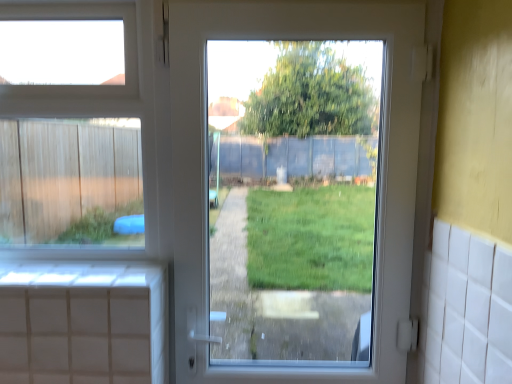
Question: Could you tell me if white glossy door at center is turned towards transparent glass window at upper left?

Choices:
 (A) yes
 (B) no

Answer: (B)

Question: Are white glossy door at center and transparent glass window at upper left located far from each other?

Choices:
 (A) yes
 (B) no

Answer: (B)

Question: Is white glossy door at center taller than transparent glass window at upper left?

Choices:
 (A) yes
 (B) no

Answer: (A)

Question: Is white glossy door at center looking in the opposite direction of transparent glass window at upper left?

Choices:
 (A) yes
 (B) no

Answer: (B)

Question: From a real-world perspective, is white glossy door at center located higher than transparent glass window at upper left?

Choices:
 (A) yes
 (B) no

Answer: (B)

Question: Is white glossy door at center to the left of transparent glass window at upper left from the viewer's perspective?

Choices:
 (A) yes
 (B) no

Answer: (B)

Question: Is there a large distance between transparent glass window at upper left and white glossy door at center?

Choices:
 (A) yes
 (B) no

Answer: (B)

Question: From a real-world perspective, is transparent glass window at upper left on white glossy door at center?

Choices:
 (A) yes
 (B) no

Answer: (A)

Question: From a real-world perspective, does transparent glass window at upper left sit lower than white glossy door at center?

Choices:
 (A) yes
 (B) no

Answer: (B)

Question: Is white glossy door at center a part of transparent glass window at upper left?

Choices:
 (A) no
 (B) yes

Answer: (A)

Question: Can you confirm if transparent glass window at upper left is wider than white glossy door at center?

Choices:
 (A) yes
 (B) no

Answer: (B)

Question: Is transparent glass window at upper left in contact with white glossy door at center?

Choices:
 (A) yes
 (B) no

Answer: (B)

Question: From the image's perspective, is transparent glass window at upper left positioned above or below white glossy door at center?

Choices:
 (A) above
 (B) below

Answer: (A)